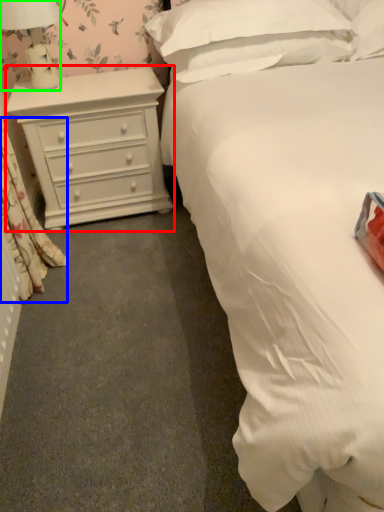
Question: Estimate the real-world distances between objects in this image. Which object is closer to chest of drawers (highlighted by a red box), curtain (highlighted by a blue box) or lamp (highlighted by a green box)?

Choices:
 (A) curtain
 (B) lamp

Answer: (B)